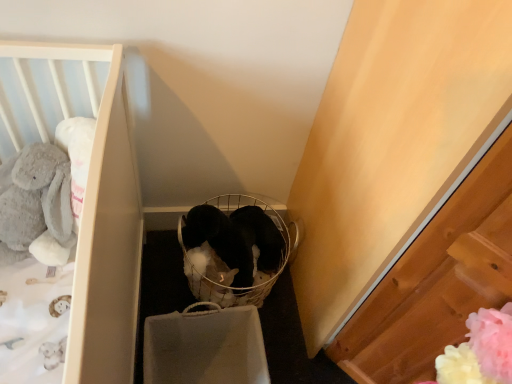
Question: Looking at their shapes, would you say white crib at left is wider or thinner than black plush baby carriage at center?

Choices:
 (A) wide
 (B) thin

Answer: (B)

Question: In terms of height, does white crib at left look taller or shorter compared to black plush baby carriage at center?

Choices:
 (A) tall
 (B) short

Answer: (B)

Question: Considering the real-world distances, which object is farthest from the black plush baby carriage at center?

Choices:
 (A) white crib at left
 (B) soft gray plush rabbit at left

Answer: (B)

Question: Which is nearer to the white crib at left?

Choices:
 (A) soft gray plush rabbit at left
 (B) black plush baby carriage at center

Answer: (A)